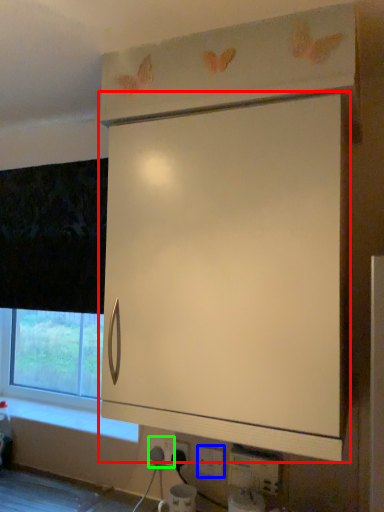
Question: Which object is positioned farthest from cabinetry (highlighted by a red box)? Select from electric outlet (highlighted by a blue box) and electric outlet (highlighted by a green box).

Choices:
 (A) electric outlet
 (B) electric outlet

Answer: (B)